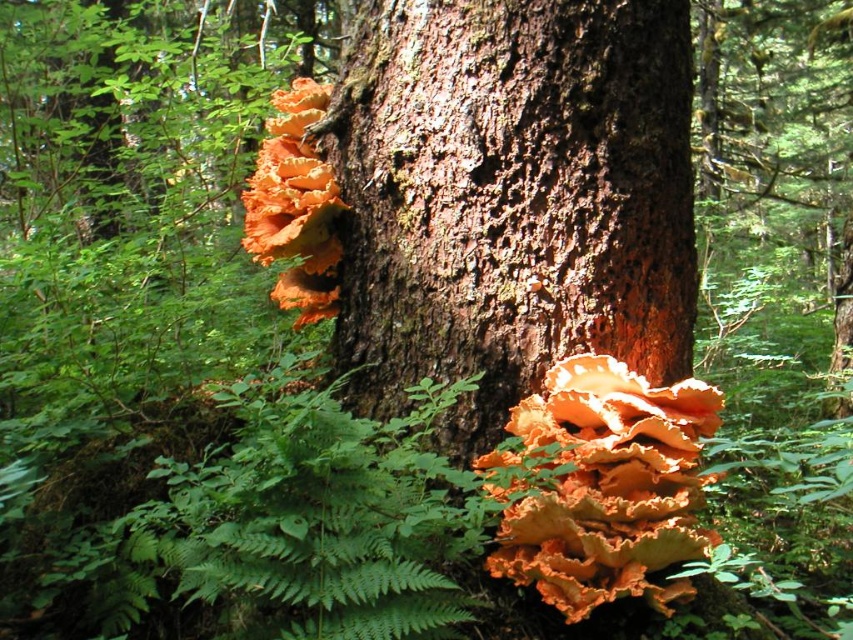
Question: Is orange papery fungus at center wider than orange papery fungi at upper center?

Choices:
 (A) yes
 (B) no

Answer: (A)

Question: Is green leafy fern at lower center thinner than orange papery fungus at center?

Choices:
 (A) no
 (B) yes

Answer: (A)

Question: In this image, where is rough bark tree trunk at center located relative to orange papery fungus at center?

Choices:
 (A) left
 (B) right

Answer: (A)

Question: Among these objects, which one is farthest from the camera?

Choices:
 (A) orange papery fungi at upper center
 (B) orange papery fungus at center
 (C) green leafy fern at lower center
 (D) rough bark tree trunk at center

Answer: (A)

Question: Estimate the real-world distances between objects in this image. Which object is closer to the green leafy fern at lower center?

Choices:
 (A) orange papery fungi at upper center
 (B) rough bark tree trunk at center

Answer: (B)

Question: Among these points, which one is farthest from the camera?

Choices:
 (A) (339, 444)
 (B) (602, 419)

Answer: (B)